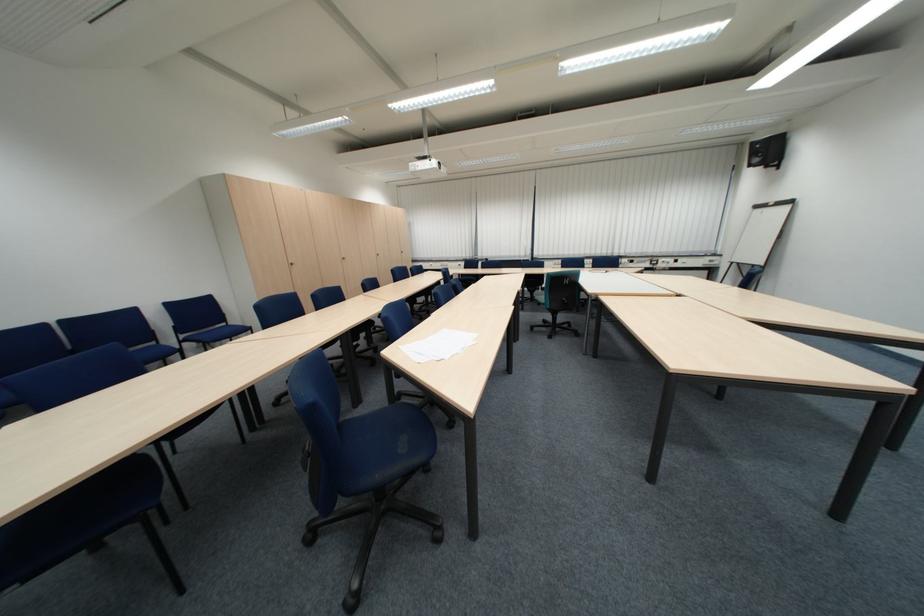
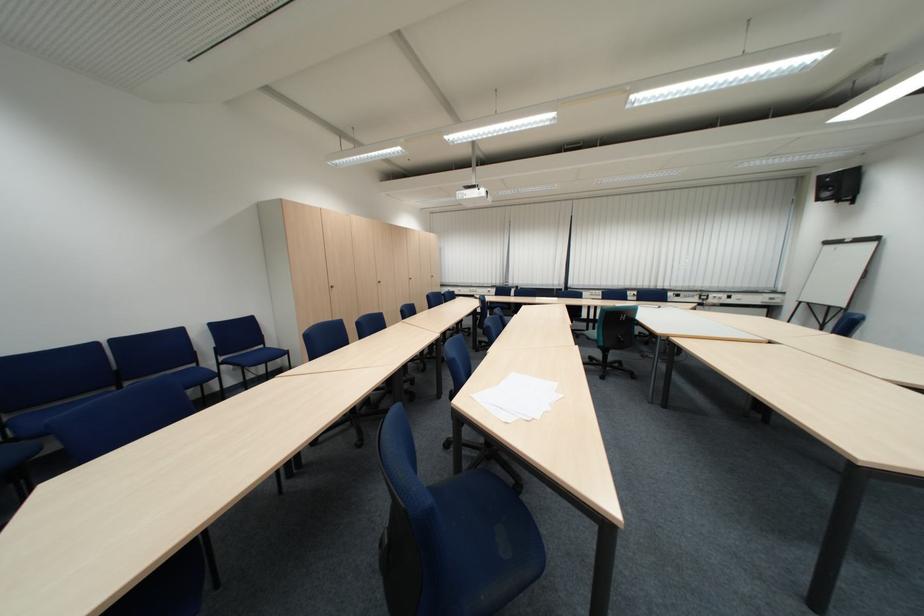
In the second image, find the point that corresponds to point (196, 338) in the first image.

(235, 360)